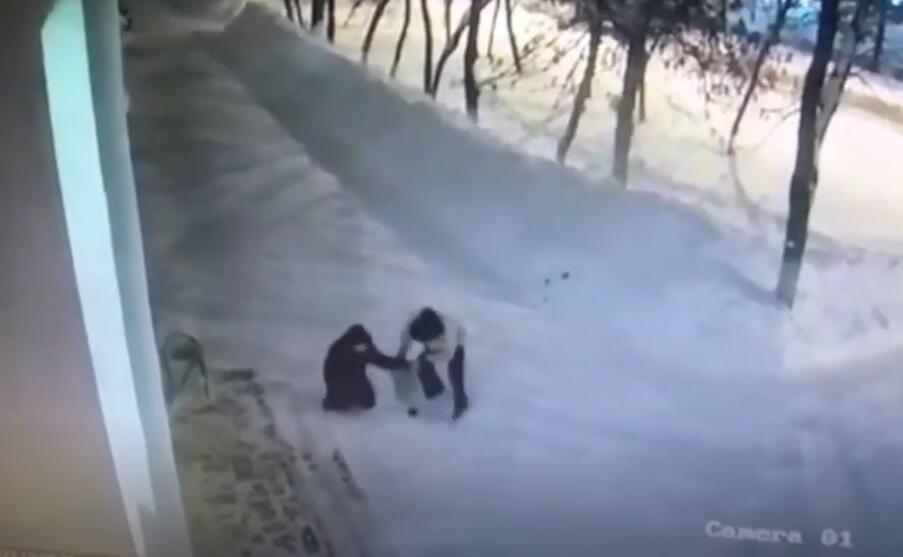
This screenshot has height=557, width=903. I want to click on top step, so click(253, 488).